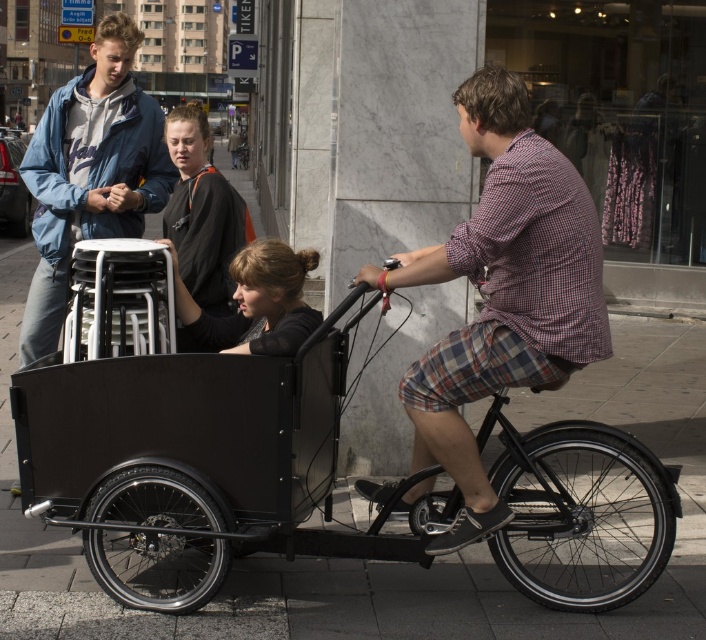
You are a pedestrian standing on the sidewalk. You see a man riding a black cargo bike with two passengers. One passenger is wearing a matte blue jacket at upper left and the other is wearing a black fabric jacket at center. Which passenger is closer to you?

The matte blue jacket at upper left is closer to you because the black fabric jacket at center is behind it.

You are a delivery drone operator. You need to deliver a package to the person wearing the matte blue jacket at upper left, who is currently on a cargo bike. The drone can only fly 1.5 meters away from the target. Can the drone safely deliver the package without getting too close to the black fabric jacket at center?

The distance between the matte blue jacket at upper left and the black fabric jacket at center is 1.83 meters. Since the drone can only fly 1.5 meters away from the target, it would not be able to safely deliver the package without getting too close to the black fabric jacket at center.